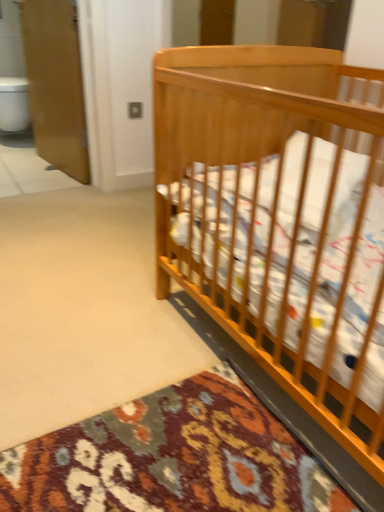
Identify the location of white glossy toilet bowl at left. The image size is (384, 512). (14, 104).

The width and height of the screenshot is (384, 512). What do you see at coordinates (29, 173) in the screenshot?
I see `white tile at left` at bounding box center [29, 173].

This screenshot has height=512, width=384. In order to click on light brown wood crib at right in this screenshot , I will do `click(271, 218)`.

This screenshot has height=512, width=384. In order to click on infant bed in front of the white tile at left in this screenshot , I will do `click(271, 218)`.

Is point (43, 182) closer to viewer compared to point (260, 148)?

No, (43, 182) is further to viewer.

Is white tile at left in front of light brown wood crib at right?

No.

From the image's perspective, relative to light brown wood crib at right, is white tile at left above or below?

white tile at left is above light brown wood crib at right.

In the scene shown: Which is more distant, (9, 88) or (35, 94)?

The point (9, 88) is behind.

How different are the orientations of white glossy toilet bowl at left and wooden screen door at upper left in degrees?

The angle between the facing direction of white glossy toilet bowl at left and the facing direction of wooden screen door at upper left is 82.4 degrees.

Is white glossy toilet bowl at left completely or partially outside of wooden screen door at upper left?

Absolutely, white glossy toilet bowl at left is external to wooden screen door at upper left.

Consider the image. Which object is closer to the camera, white glossy toilet bowl at left or wooden screen door at upper left?

wooden screen door at upper left is closer to the camera.

From the image's perspective, which object appears higher, light brown wood crib at right or white glossy toilet bowl at left?

white glossy toilet bowl at left is shown above in the image.

Does light brown wood crib at right have a lesser height compared to white glossy toilet bowl at left?

No, light brown wood crib at right is not shorter than white glossy toilet bowl at left.

Is light brown wood crib at right directly adjacent to white glossy toilet bowl at left?

light brown wood crib at right is not next to white glossy toilet bowl at left, and they're not touching.

From a real-world perspective, is white tile at left located beneath wooden screen door at upper left?

Yes, from a real-world perspective, white tile at left is below wooden screen door at upper left.

Locate an element on the screen. tile on the left of wooden screen door at upper left is located at coordinates (29, 173).

Who is bigger, white tile at left or wooden screen door at upper left?

wooden screen door at upper left.

Is white tile at left oriented away from wooden screen door at upper left?

white tile at left is not turned away from wooden screen door at upper left.

From the image's perspective, is wooden screen door at upper left beneath white tile at left?

Incorrect, from the image's perspective, wooden screen door at upper left is higher than white tile at left.

From a real-world perspective, is wooden screen door at upper left physically below white tile at left?

No, from a real-world perspective, wooden screen door at upper left is not beneath white tile at left.

Is wooden screen door at upper left inside or outside of white tile at left?

wooden screen door at upper left exists outside the volume of white tile at left.

What are the coordinates of `screen door above the white tile at left (from the image's perspective)` in the screenshot? It's located at (55, 84).

Measure the distance between light brown wood crib at right and white tile at left.

5.77 feet.

Considering the relative positions of light brown wood crib at right and white tile at left in the image provided, is light brown wood crib at right to the left or to the right of white tile at left?

In the image, light brown wood crib at right appears on the right side of white tile at left.

Between light brown wood crib at right and white tile at left, which one is positioned in front?

light brown wood crib at right is in front.

How distant is wooden screen door at upper left from light brown wood crib at right?

wooden screen door at upper left is 5.39 feet from light brown wood crib at right.

Between wooden screen door at upper left and light brown wood crib at right, which one has larger width?

light brown wood crib at right.

Could you tell me if wooden screen door at upper left is turned towards light brown wood crib at right?

No, wooden screen door at upper left is not aimed at light brown wood crib at right.

Considering the relative positions of wooden screen door at upper left and light brown wood crib at right in the image provided, is wooden screen door at upper left behind light brown wood crib at right?

Yes, it is.

In order to click on tile on the left of light brown wood crib at right in this screenshot , I will do (29, 173).

The image size is (384, 512). I want to click on screen door above the white glossy toilet bowl at left (from a real-world perspective), so click(55, 84).

Based on the photo, estimate the real-world distances between objects in this image. Which object is closer to wooden screen door at upper left, white glossy toilet bowl at left or light brown wood crib at right?

Based on the image, white glossy toilet bowl at left appears to be nearer to wooden screen door at upper left.

Based on their spatial positions, is light brown wood crib at right or white tile at left further from white glossy toilet bowl at left?

light brown wood crib at right.

From the picture: Looking at the image, which one is located further to white glossy toilet bowl at left, wooden screen door at upper left or light brown wood crib at right?

light brown wood crib at right is further to white glossy toilet bowl at left.

Estimate the real-world distances between objects in this image. Which object is closer to white glossy toilet bowl at left, wooden screen door at upper left or white tile at left?

white tile at left.

Looking at the image, which one is located further to white glossy toilet bowl at left, white tile at left or light brown wood crib at right?

The object further to white glossy toilet bowl at left is light brown wood crib at right.

From the image, which object appears to be farther from white tile at left, light brown wood crib at right or white glossy toilet bowl at left?

Based on the image, light brown wood crib at right appears to be further to white tile at left.

Which object lies further to the anchor point white tile at left, white glossy toilet bowl at left or wooden screen door at upper left?

white glossy toilet bowl at left is positioned further to the anchor white tile at left.

Which object lies further to the anchor point light brown wood crib at right, white glossy toilet bowl at left or white tile at left?

Among the two, white glossy toilet bowl at left is located further to light brown wood crib at right.

Image resolution: width=384 pixels, height=512 pixels. Identify the location of tile between light brown wood crib at right and white glossy toilet bowl at left from front to back. (29, 173).

Where is `screen door between light brown wood crib at right and white glossy toilet bowl at left from front to back`? screen door between light brown wood crib at right and white glossy toilet bowl at left from front to back is located at coordinates (55, 84).

What are the coordinates of `tile located between wooden screen door at upper left and white glossy toilet bowl at left in the depth direction` in the screenshot? It's located at (29, 173).

Where is `screen door between light brown wood crib at right and white tile at left along the z-axis`? screen door between light brown wood crib at right and white tile at left along the z-axis is located at coordinates [55, 84].